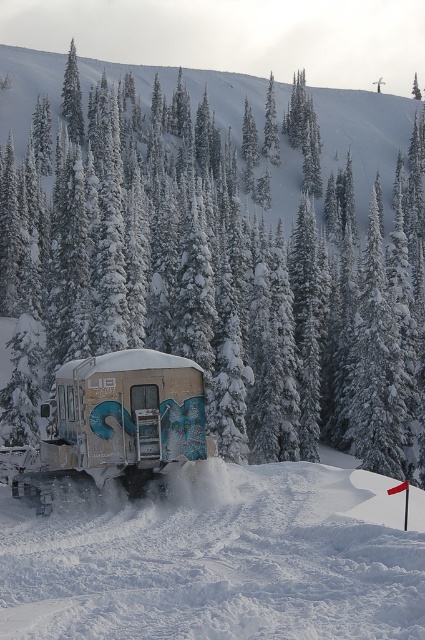
Is white snow-covered tree at center above rusty metallic trailer at center?

Indeed, white snow-covered tree at center is positioned over rusty metallic trailer at center.

In the scene shown: Which of these two, white snow-covered tree at center or rusty metallic trailer at center, stands taller?

Standing taller between the two is white snow-covered tree at center.

Which is in front, point (40, 236) or point (115, 465)?

Point (115, 465) is more forward.

At what (x,y) coordinates should I click in order to perform the action: click on white snow-covered tree at center. Please return your answer as a coordinate pair (x, y). The height and width of the screenshot is (640, 425). Looking at the image, I should click on click(224, 268).

Does white snow-covered tree at center have a larger size compared to white powdery snow at center?

Yes.

Between white snow-covered tree at center and white powdery snow at center, which one has less height?

white powdery snow at center

Is point (189, 300) closer to viewer compared to point (396, 538)?

No, (189, 300) is further to viewer.

Locate an element on the screen. Image resolution: width=425 pixels, height=640 pixels. white snow-covered tree at center is located at coordinates (224, 268).

Is white powdery snow at center to the left of rusty metallic trailer at center from the viewer's perspective?

In fact, white powdery snow at center is to the right of rusty metallic trailer at center.

Does point (158, 570) come closer to viewer compared to point (166, 464)?

Yes.

At what (x,y) coordinates should I click in order to perform the action: click on white powdery snow at center. Please return your answer as a coordinate pair (x, y). The image size is (425, 640). Looking at the image, I should click on (221, 560).